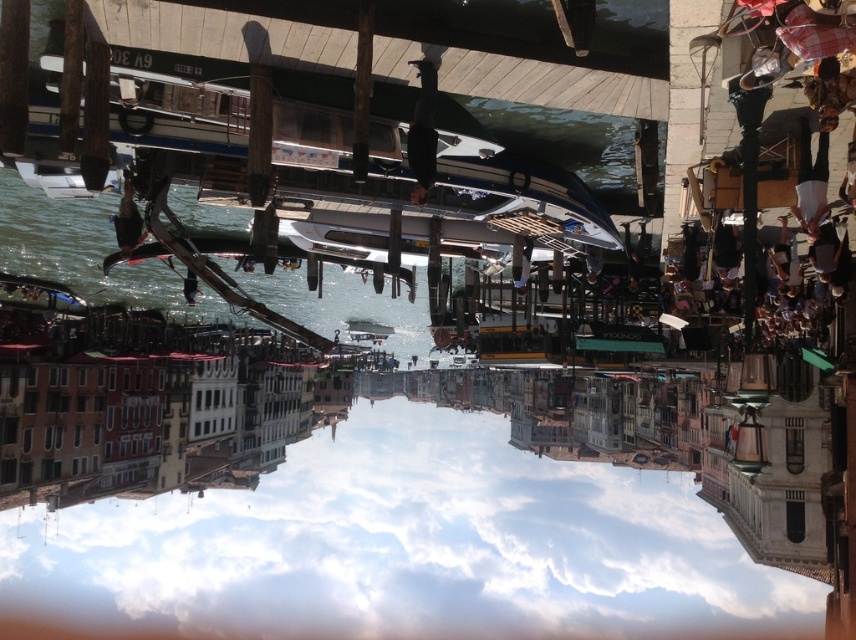
You are a photographer standing at the edge of the canal in Venice, and you want to take a photo that includes both the point at coordinates point (x=455, y=212) and point (x=352, y=324). Which point will appear larger in your photo?

Point (x=455, y=212) will appear larger in the photo because it is closer to the camera than point (x=352, y=324).